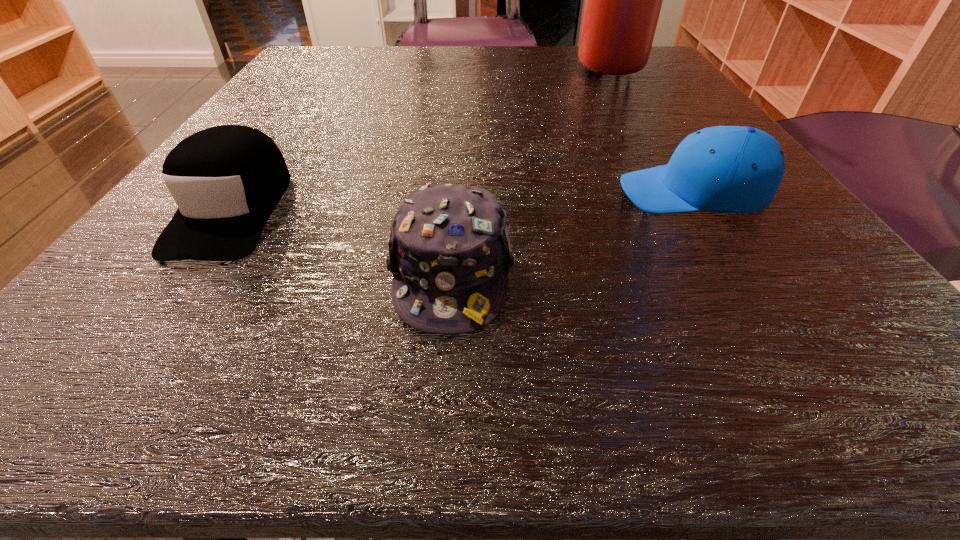
You are a GUI agent. You are given a task and a screenshot of the screen. Output one action in this format:
    pyautogui.click(x=<x>, y=<y>)
    Task: Click on the free space at the near edge of the desktop
    
    Given the screenshot: What is the action you would take?
    pyautogui.click(x=672, y=341)

You are a GUI agent. You are given a task and a screenshot of the screen. Output one action in this format:
    pyautogui.click(x=<x>, y=<y>)
    Task: Click on the vacant space at the left edge
    
    Given the screenshot: What is the action you would take?
    pyautogui.click(x=315, y=90)

Identify the location of vacant space at the right edge of the desktop. (641, 93).

This screenshot has width=960, height=540. I want to click on free space at the far left corner of the desktop, so click(293, 83).

This screenshot has width=960, height=540. I want to click on vacant space in between the second headwear from left to right and the rightmost headwear, so click(x=572, y=233).

The height and width of the screenshot is (540, 960). Identify the location of empty space that is in between the rightmost headwear and the fire extinguisher. (650, 128).

Locate an element on the screen. The image size is (960, 540). vacant area that lies between the rightmost headwear and the fire extinguisher is located at coordinates (650, 128).

I want to click on empty location between the second headwear from left to right and the leftmost headwear, so click(x=342, y=241).

What are the coordinates of `free space between the leftmost object and the third object from right to left` in the screenshot? It's located at (342, 241).

You are a GUI agent. You are given a task and a screenshot of the screen. Output one action in this format:
    pyautogui.click(x=<x>, y=<y>)
    Task: Click on the free spot between the second headwear from left to right and the tallest object
    
    Given the screenshot: What is the action you would take?
    pyautogui.click(x=529, y=168)